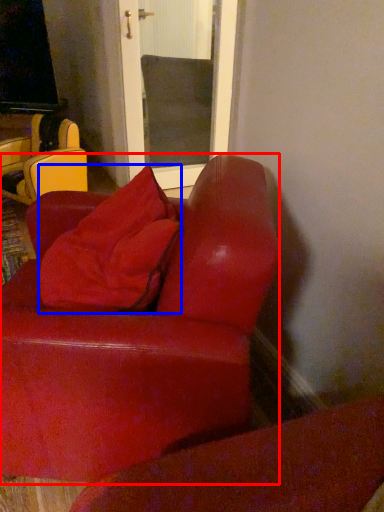
Question: Which object appears farthest to the camera in this image, studio couch (highlighted by a red box) or throw pillow (highlighted by a blue box)?

Choices:
 (A) studio couch
 (B) throw pillow

Answer: (B)